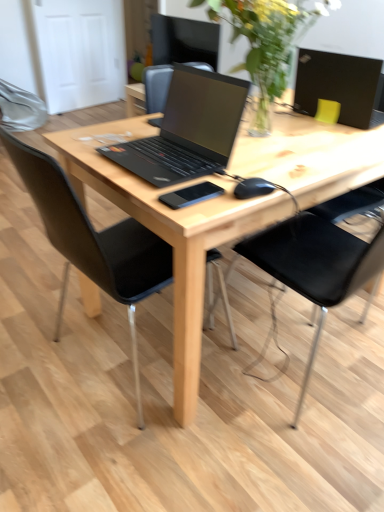
In order to click on free space in front of black leather chair at center, acting as the 2th chair starting from the left in this screenshot , I will do `click(293, 450)`.